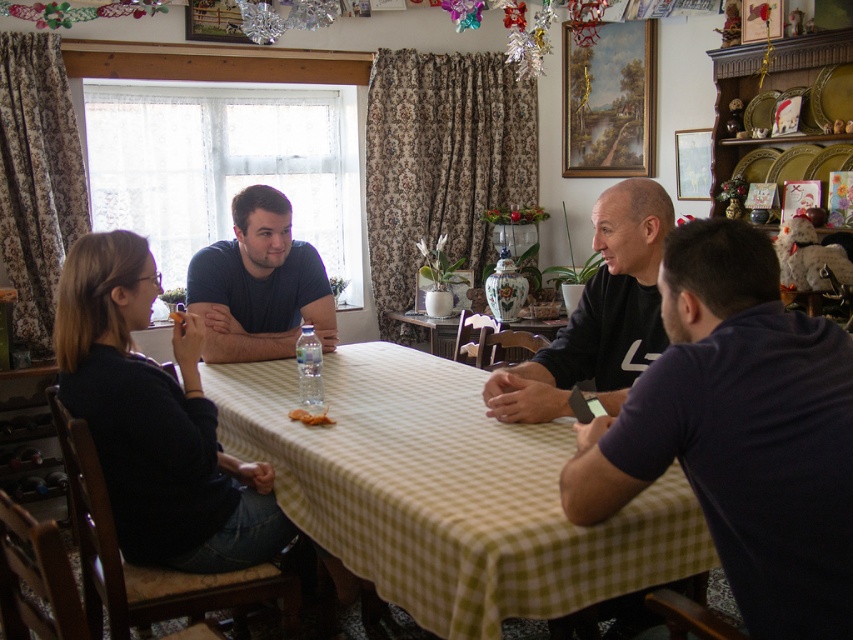
Does green checkered tablecloth at center have a lesser width compared to yellow cracker at table center?

Incorrect, green checkered tablecloth at center's width is not less than yellow cracker at table center's.

Is green checkered tablecloth at center to the left of yellow cracker at table center from the viewer's perspective?

Incorrect, green checkered tablecloth at center is not on the left side of yellow cracker at table center.

I want to click on green checkered tablecloth at center, so click(428, 328).

Which of these two, dark blue shirt at center or black matte shirt at center, stands shorter?

black matte shirt at center is shorter.

Can you confirm if dark blue shirt at center is smaller than black matte shirt at center?

Incorrect, dark blue shirt at center is not smaller in size than black matte shirt at center.

From the picture: Who is more distant from viewer, (505, 528) or (643, 218)?

Positioned behind is point (643, 218).

This screenshot has height=640, width=853. Identify the location of dark blue shirt at center. (447, 492).

Does dark blue t-shirt at right lie behind yellow cracker at table center?

No, dark blue t-shirt at right is in front of yellow cracker at table center.

Which is in front, point (776, 456) or point (323, 422)?

Point (776, 456) is more forward.

Locate an element on the screen. dark blue t-shirt at right is located at coordinates (740, 432).